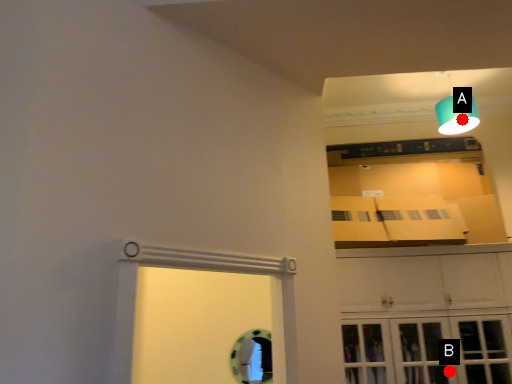
Question: Two points are circled on the image, labeled by A and B beside each circle. Among these points, which one is farthest from the camera?

Choices:
 (A) A is further
 (B) B is further

Answer: (A)